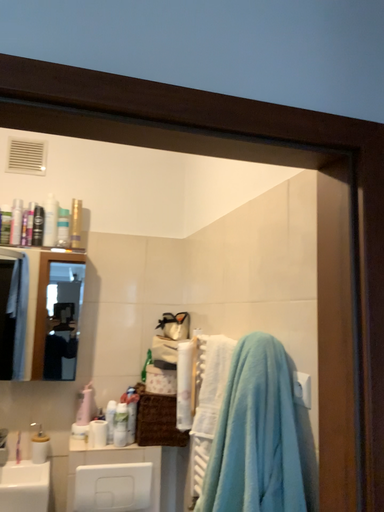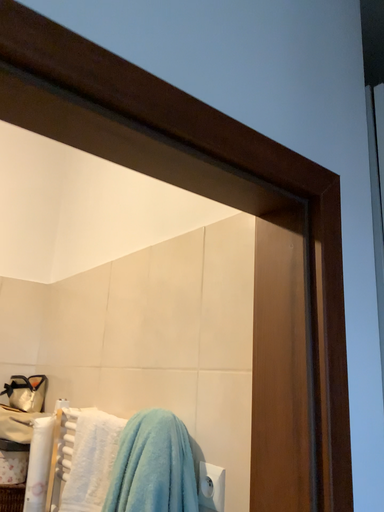
Question: Which way did the camera rotate in the video?

Choices:
 (A) rotated upward
 (B) rotated downward

Answer: (A)